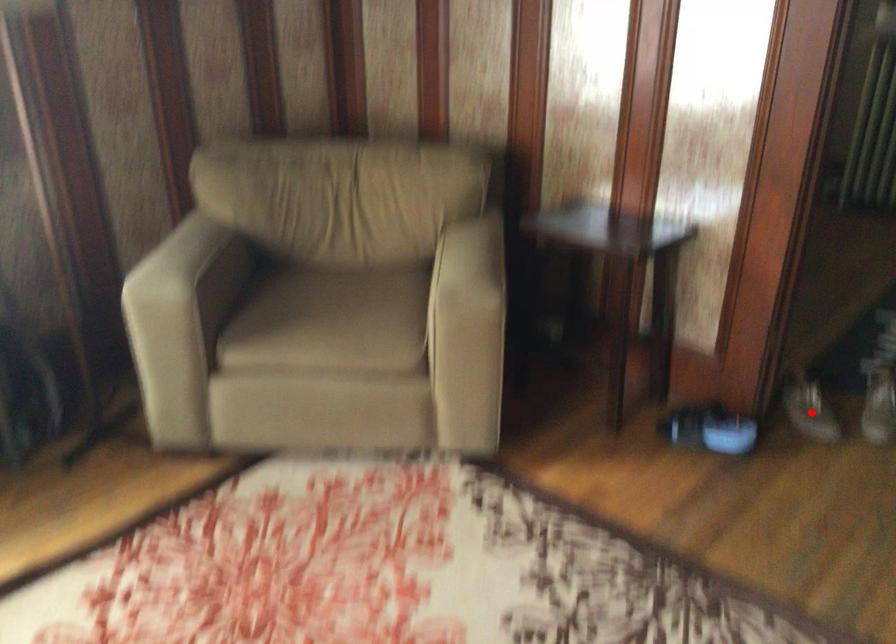
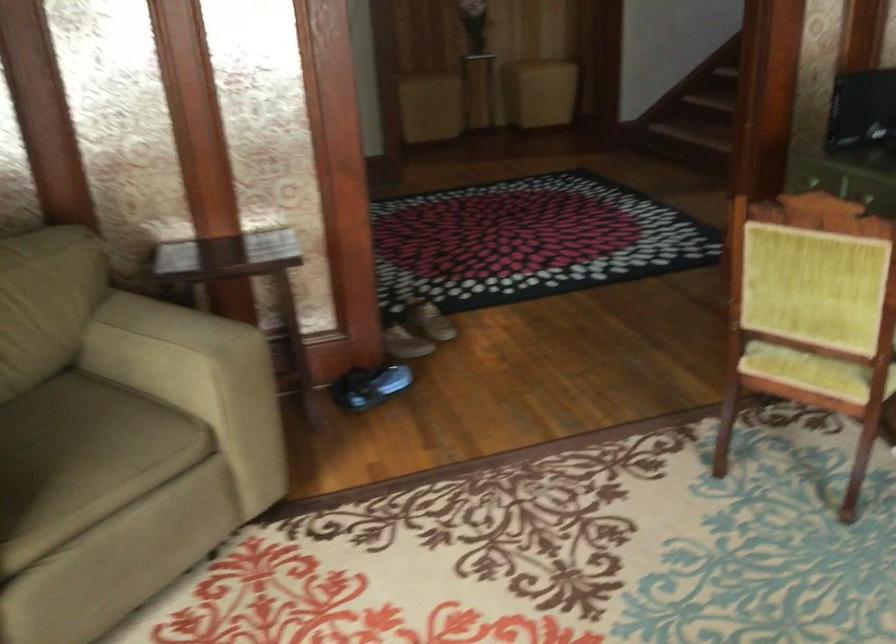
The point at the highlighted location is marked in the first image. Where is the corresponding point in the second image?

(405, 343)